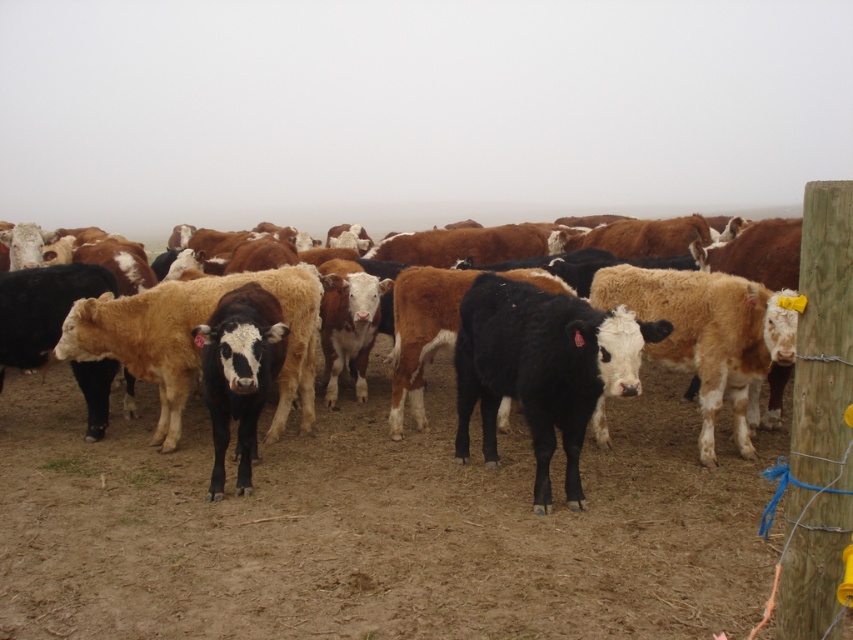
Question: Where is brown/white fur at center located in relation to black glossy cow at center in the image?

Choices:
 (A) below
 (B) above

Answer: (A)

Question: Which point is farther to the camera?

Choices:
 (A) black glossy cow at center
 (B) black smooth cow at center
 (C) brown/white fur at center

Answer: (A)

Question: Among these objects, which one is farthest from the camera?

Choices:
 (A) black smooth cow at center
 (B) black glossy cow at center
 (C) brown/white fur at center

Answer: (B)

Question: Is brown/white fur at center below black glossy cow at center?

Choices:
 (A) yes
 (B) no

Answer: (A)

Question: Does brown/white fur at center appear on the left side of black smooth cow at center?

Choices:
 (A) no
 (B) yes

Answer: (B)

Question: Which of the following is the closest to the observer?

Choices:
 (A) (9, 435)
 (B) (229, 298)

Answer: (B)